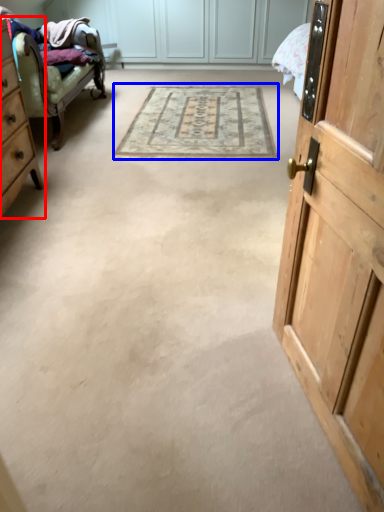
Question: Which point is closer to the camera, cabinetry (highlighted by a red box) or mat (highlighted by a blue box)?

Choices:
 (A) cabinetry
 (B) mat

Answer: (A)